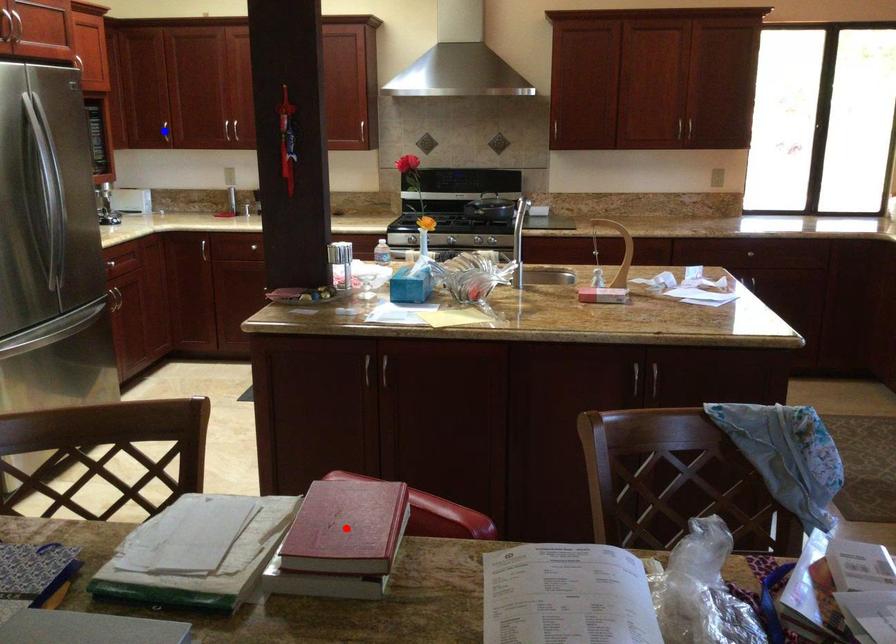
Question: In the image, two points are highlighted. Which point is nearer to the camera? Reply with the corresponding letter.

Choices:
 (A) blue point
 (B) red point

Answer: (B)